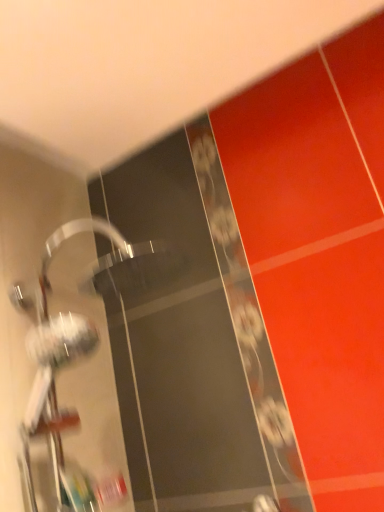
You are a GUI agent. You are given a task and a screenshot of the screen. Output one action in this format:
    pyautogui.click(x=<x>, y=<y>)
    Task: Click on the transparent glass door at center
    The height and width of the screenshot is (512, 384).
    Given the screenshot: What is the action you would take?
    pyautogui.click(x=190, y=340)

Describe the element at coordinates (190, 340) in the screenshot. Image resolution: width=384 pixels, height=512 pixels. I see `transparent glass door at center` at that location.

This screenshot has width=384, height=512. Identify the location of transparent glass door at center. (190, 340).